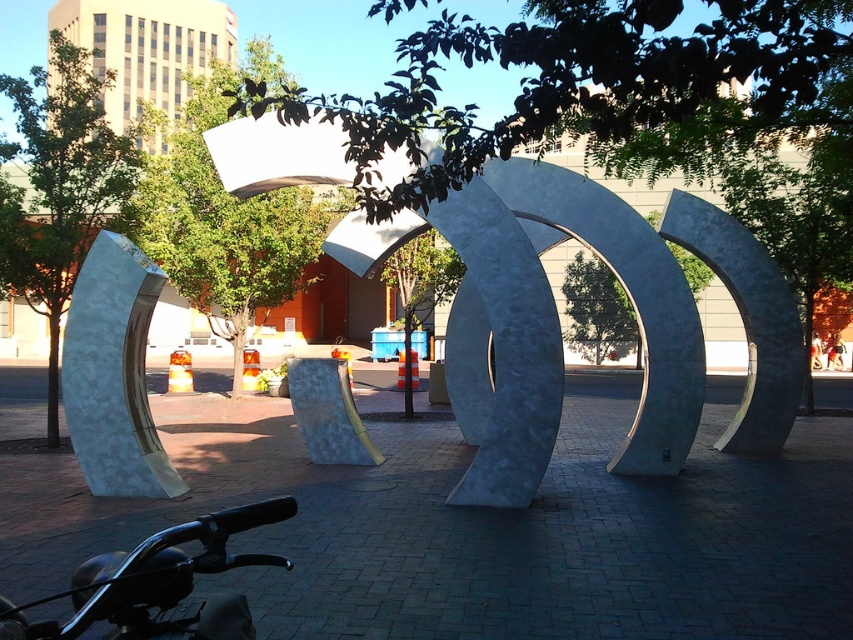
Question: Which object is farther from the camera taking this photo?

Choices:
 (A) black matte motorcycle handlebars at lower left
 (B) metallic silver sculpture at center

Answer: (B)

Question: Is metallic silver sculpture at center wider than black matte motorcycle handlebars at lower left?

Choices:
 (A) yes
 (B) no

Answer: (B)

Question: Is metallic silver sculpture at center positioned before black matte motorcycle handlebars at lower left?

Choices:
 (A) yes
 (B) no

Answer: (B)

Question: Can you confirm if metallic silver sculpture at center is bigger than black matte motorcycle handlebars at lower left?

Choices:
 (A) no
 (B) yes

Answer: (A)

Question: Which point is farther to the camera?

Choices:
 (A) black matte motorcycle handlebars at lower left
 (B) metallic silver sculpture at center

Answer: (B)